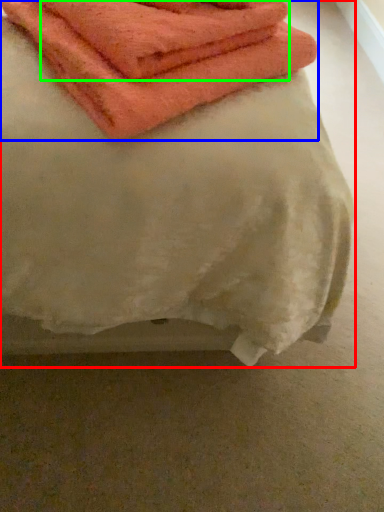
Question: Considering the real-world distances, which object is closest to towel (highlighted by a red box)? towel (highlighted by a blue box) or towel (highlighted by a green box).

Choices:
 (A) towel
 (B) towel

Answer: (A)